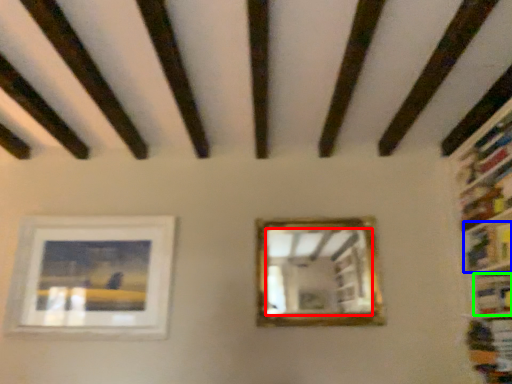
Question: Considering the real-world distances, which object is farthest from mirror (highlighted by a red box)? book (highlighted by a blue box) or book (highlighted by a green box)?

Choices:
 (A) book
 (B) book

Answer: (B)